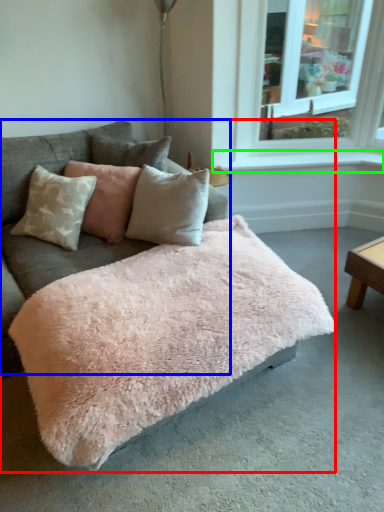
Question: Which is nearer to the studio couch (highlighted by a red box)? couch (highlighted by a blue box) or window sill (highlighted by a green box).

Choices:
 (A) couch
 (B) window sill

Answer: (A)